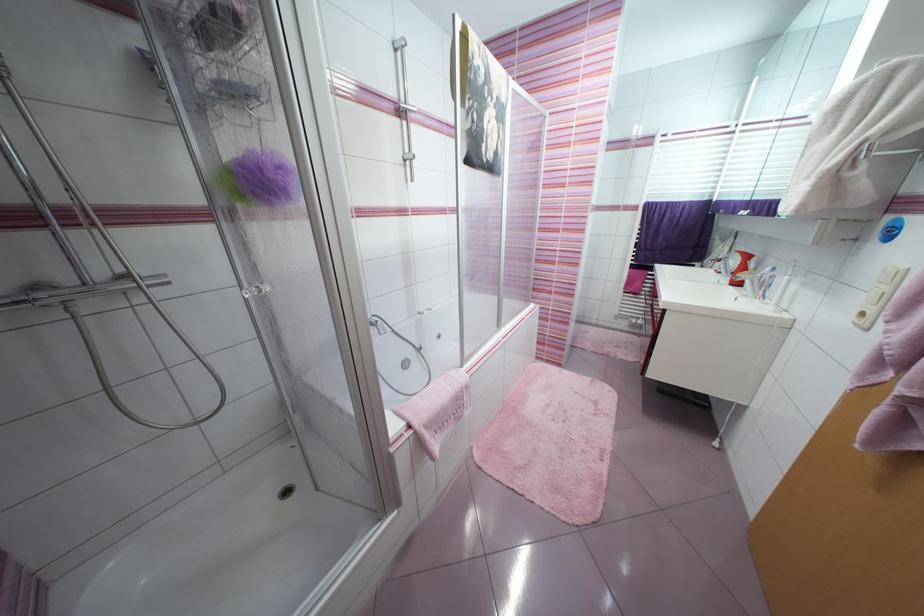
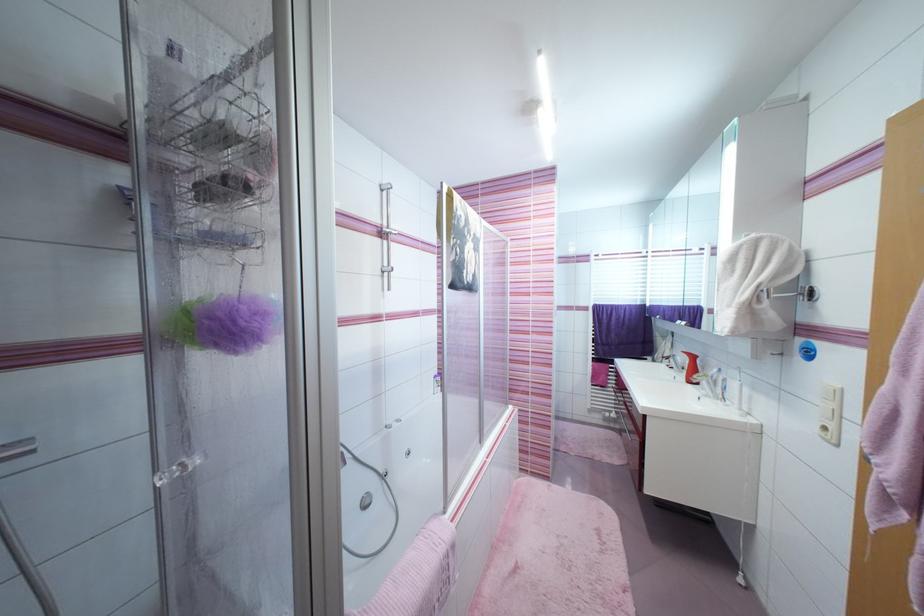
Find the pixel in the second image that matches [813,179] in the first image.

(735, 307)